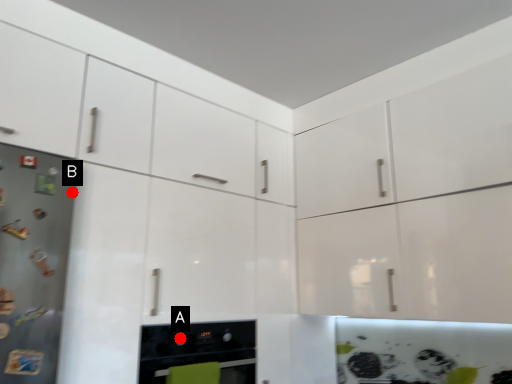
Question: Two points are circled on the image, labeled by A and B beside each circle. Which point appears closest to the camera in this image?

Choices:
 (A) A is closer
 (B) B is closer

Answer: (B)